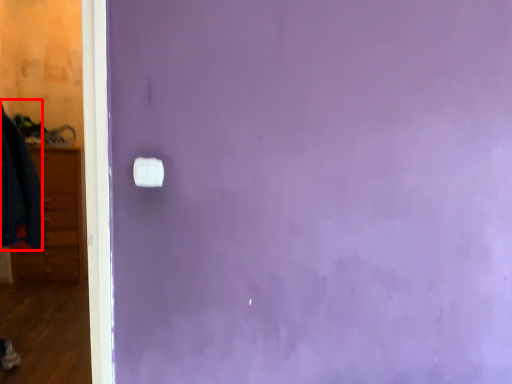
Question: From the image's perspective, what is the correct spatial relationship of clothing (annotated by the red box) in relation to light switch?

Choices:
 (A) below
 (B) above

Answer: (B)